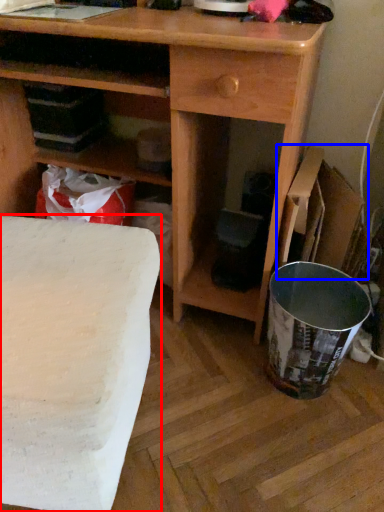
Question: Among these objects, which one is nearest to the camera, table (highlighted by a red box) or cardboard box (highlighted by a blue box)?

Choices:
 (A) table
 (B) cardboard box

Answer: (A)